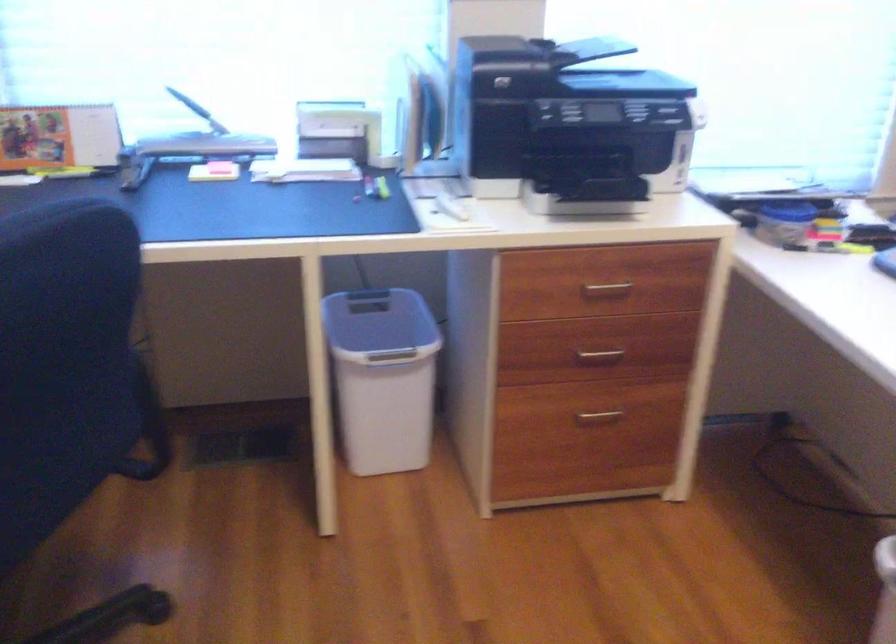
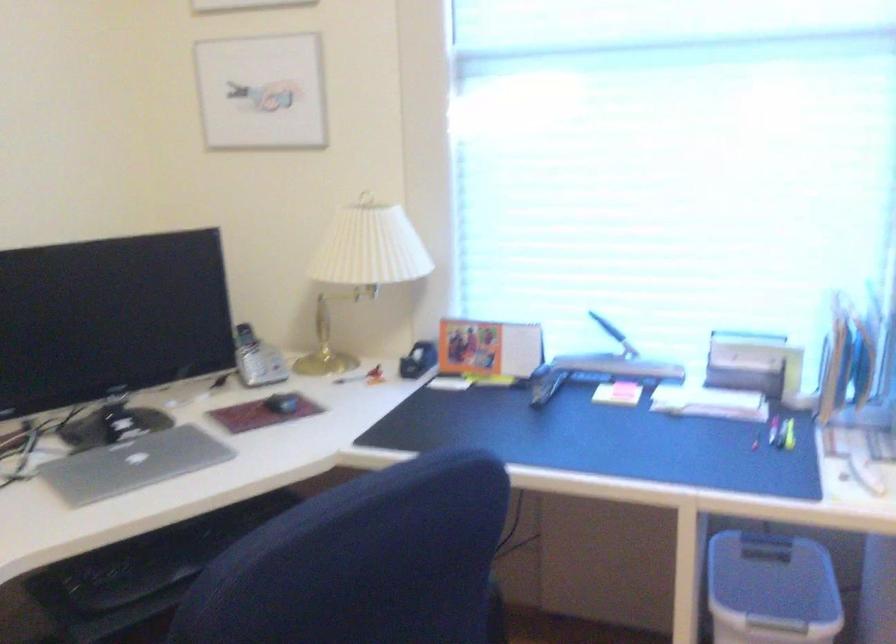
Question: How did the camera likely rotate?

Choices:
 (A) Left
 (B) Right
 (C) Up
 (D) Down

Answer: (A)